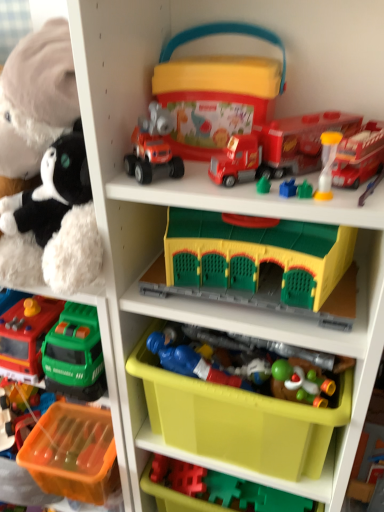
Question: From a real-world perspective, is translucent orange plastic tray at lower left, which appears as the 2th toy when ordered from the bottom, physically located above or below orange plastic storage box at lower left, which is the first storage box from bottom to top?

Choices:
 (A) above
 (B) below

Answer: (B)

Question: From the image's perspective, is translucent orange plastic tray at lower left, which appears as the 2th toy when ordered from the bottom, above or below orange plastic storage box at lower left, placed as the third storage box when sorted from top to bottom?

Choices:
 (A) above
 (B) below

Answer: (A)

Question: Which object is positioned closest to the translucent orange plastic tray at lower left, acting as the ninth toy starting from the top?

Choices:
 (A) green matte yoshi at lower center, which is counted as the eighth toy, starting from the top
 (B) rubberized red truck at center, which is counted as the eighth toy, starting from the bottom
 (C) fluffy plush toy at left, arranged as the 10th toy when ordered from the bottom
 (D) rubberized red truck at upper center, the ninth toy from the bottom
 (E) translucent yellow hourglass at upper right, which is counted as the 7th toy, starting from the bottom

Answer: (C)

Question: Which is farther from the translucent yellow hourglass at upper right, which is counted as the 7th toy, starting from the bottom?

Choices:
 (A) fluffy plush toy at left, marked as the first toy in a top-to-bottom arrangement
 (B) yellow plastic building at center, the 6th toy positioned from the top
 (C) orange plastic storage box at lower left, placed as the third storage box when sorted from top to bottom
 (D) rubberized red truck at center, which is counted as the eighth toy, starting from the bottom
 (E) green matte yoshi at lower center, the 3th toy ordered from the bottom

Answer: (C)